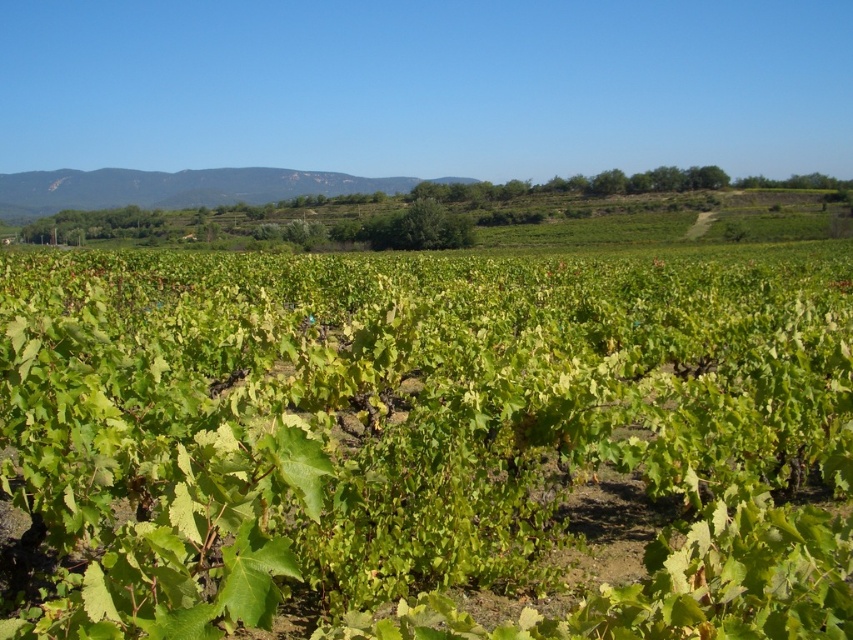
Describe the element at coordinates (422, 433) in the screenshot. I see `green leafy vines at center` at that location.

Does point (93, 332) come closer to viewer compared to point (91, 182)?

Yes, it is.

Which is behind, point (309, 352) or point (90, 208)?

Point (90, 208)

In order to click on green leafy vines at center in this screenshot , I will do [x=422, y=433].